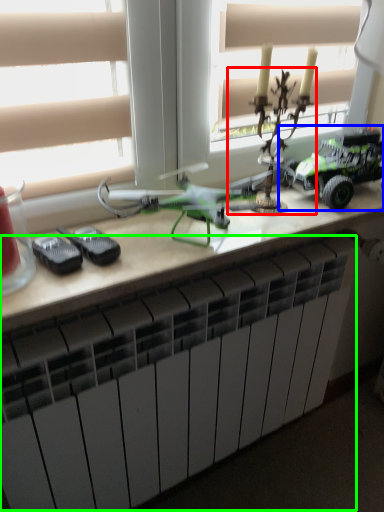
Question: Based on their relative distances, which object is farther from toy (highlighted by a red box)? Choose from toy (highlighted by a blue box) and radiator (highlighted by a green box).

Choices:
 (A) toy
 (B) radiator

Answer: (B)